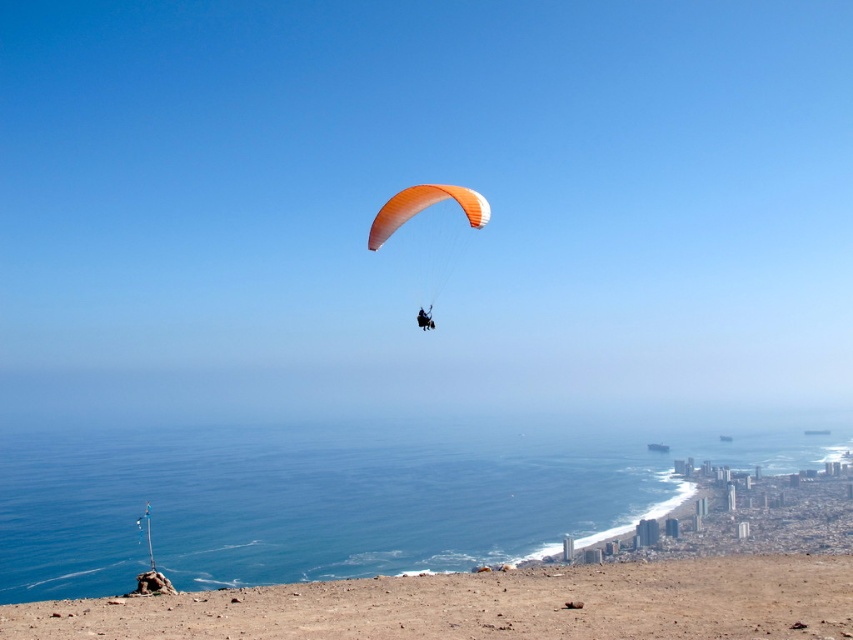
Based on the photo, you are a photographer trying to capture the paraglider against the city skyline. Based on the scene, which object, the blue water at lower center or the orange fabric parachute at upper center, would be closer to the camera lens?

The orange fabric parachute at upper center is closer to the camera lens because it is positioned higher in the frame than the blue water at lower center, which has a greater height but is located lower down.

You are standing at the cliffside viewpoint and want to take a photo of the paraglider. There are two points marked in the scene, point A at coordinates point A is point (401,204) and point B at coordinates point B is point (428,312). Which point should you focus on to ensure the paraglider is closer to the camera?

You should focus on point A at coordinates point A is point (401,204) because it is closer to the viewer than point B at coordinates point B is point (428,312).

Looking at this image, you are a drone operator trying to capture the paraglider in the image. The drone has a camera with a 100mm lens that can focus on objects at a specific coordinate. The camera is currently pointed at coordinate point 0.327, 0.498. Is the orange nylon parachute at center in focus?

The orange nylon parachute at center is located at point (424, 209), so yes, the camera is focused on the orange nylon parachute at center.